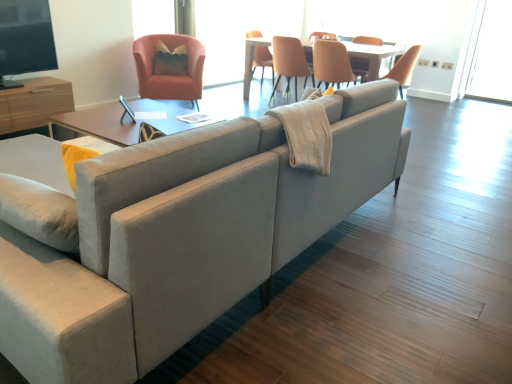
What do you see at coordinates (240, 31) in the screenshot? I see `transparent glass window screen at upper center, the second window screen in the right-to-left sequence` at bounding box center [240, 31].

Image resolution: width=512 pixels, height=384 pixels. Identify the location of light gray fabric couch at center. (184, 237).

Describe the element at coordinates (332, 63) in the screenshot. I see `leather-like beige chair at center, marked as the third chair in a left-to-right arrangement` at that location.

This screenshot has width=512, height=384. What are the coordinates of `light wood table at center` in the screenshot? It's located at (372, 56).

At what (x,y) coordinates should I click in order to perform the action: click on transparent glass window screen at upper center, which is the 1th window screen from left to right. Please return your answer as a coordinate pair (x, y). The image size is (512, 384). Looking at the image, I should click on (153, 17).

Image resolution: width=512 pixels, height=384 pixels. Describe the element at coordinates (170, 60) in the screenshot. I see `velvet yellow pillow at upper center` at that location.

Measure the distance between velvet yellow pillow at upper center and camera.

velvet yellow pillow at upper center is 4.62 meters away from camera.

Locate an element on the screen. transparent glass window screen at upper center, which is the 2th window screen from left to right is located at coordinates (240, 31).

Considering the relative sizes of leather-like beige chair at center, marked as the third chair in a left-to-right arrangement, and transparent glass window screen at upper center, the third window screen in the right-to-left sequence, in the image provided, is leather-like beige chair at center, marked as the third chair in a left-to-right arrangement, bigger than transparent glass window screen at upper center, the third window screen in the right-to-left sequence,?

Correct, leather-like beige chair at center, marked as the third chair in a left-to-right arrangement, is larger in size than transparent glass window screen at upper center, the third window screen in the right-to-left sequence.

How different are the orientations of leather-like beige chair at center, marked as the third chair in a left-to-right arrangement, and transparent glass window screen at upper center, which is the 1th window screen from left to right, in degrees?

leather-like beige chair at center, marked as the third chair in a left-to-right arrangement, and transparent glass window screen at upper center, which is the 1th window screen from left to right, are facing 93.7 degrees away from each other.

From a real-world perspective, is leather-like beige chair at center, the 1th chair viewed from the right, physically below transparent glass window screen at upper center, the third window screen in the right-to-left sequence?

Yes, from a real-world perspective, leather-like beige chair at center, the 1th chair viewed from the right, is under transparent glass window screen at upper center, the third window screen in the right-to-left sequence.

In the scene shown: Is velvet yellow pillow at upper center taller than light gray fabric couch at center?

Correct, velvet yellow pillow at upper center is much taller as light gray fabric couch at center.

Is velvet yellow pillow at upper center far away from light gray fabric couch at center?

Yes, velvet yellow pillow at upper center and light gray fabric couch at center are quite far apart.

Considering the positions of point (182, 47) and point (215, 162), is point (182, 47) closer or farther from the camera than point (215, 162)?

Point (182, 47) appears to be farther away from the viewer than point (215, 162).

Where is `pillow above the light gray fabric couch at center (from a real-world perspective)`? The image size is (512, 384). pillow above the light gray fabric couch at center (from a real-world perspective) is located at coordinates (170, 60).

Who is shorter, transparent glass window screen at upper center, which is the 1th window screen from left to right, or matte orange chair at upper center, which ranks as the second chair in left-to-right order?

transparent glass window screen at upper center, which is the 1th window screen from left to right, is shorter.

Looking at their sizes, would you say transparent glass window screen at upper center, the third window screen in the right-to-left sequence, is wider or thinner than matte orange chair at upper center, which ranks as the second chair in left-to-right order?

In the image, transparent glass window screen at upper center, the third window screen in the right-to-left sequence, appears to be more narrow than matte orange chair at upper center, which ranks as the second chair in left-to-right order.

From the image's perspective, is transparent glass window screen at upper center, which is the 1th window screen from left to right, above matte orange chair at upper center, which ranks as the second chair in left-to-right order?

Indeed, from the image's perspective, transparent glass window screen at upper center, which is the 1th window screen from left to right, is shown above matte orange chair at upper center, which ranks as the second chair in left-to-right order.

From the picture: Is transparent glass window screen at upper center, which is the 1th window screen from left to right, next to matte orange chair at upper center, which ranks as the second chair in left-to-right order?

There is a gap between transparent glass window screen at upper center, which is the 1th window screen from left to right, and matte orange chair at upper center, which ranks as the second chair in left-to-right order.

From the image's perspective, does wooden entertainment center at left, which is counted as the second entertainment center, starting from the top, appear lower than matte black tv at upper left, which ranks as the 1th entertainment center in top-to-bottom order?

Yes, from the image's perspective, wooden entertainment center at left, which is counted as the second entertainment center, starting from the top, is beneath matte black tv at upper left, which ranks as the 1th entertainment center in top-to-bottom order.

Could you measure the distance between wooden entertainment center at left, which is counted as the second entertainment center, starting from the top, and matte black tv at upper left, arranged as the 2th entertainment center when ordered from the bottom?

wooden entertainment center at left, which is counted as the second entertainment center, starting from the top, is 4.55 inches away from matte black tv at upper left, arranged as the 2th entertainment center when ordered from the bottom.

From a real-world perspective, which is physically below, wooden entertainment center at left, which is counted as the second entertainment center, starting from the top, or matte black tv at upper left, which ranks as the 1th entertainment center in top-to-bottom order?

wooden entertainment center at left, which is counted as the second entertainment center, starting from the top.

Which is correct: wooden entertainment center at left, which is counted as the second entertainment center, starting from the top, is inside matte black tv at upper left, arranged as the 2th entertainment center when ordered from the bottom, or outside of it?

The correct answer is: outside.

From the image's perspective, which one is positioned lower, wooden entertainment center at left, which is counted as the second entertainment center, starting from the top, or matte orange armchair at upper left, which is counted as the third chair, starting from the right?

From the image's view, wooden entertainment center at left, which is counted as the second entertainment center, starting from the top, is below.

Considering the positions of objects wooden entertainment center at left, which is counted as the second entertainment center, starting from the top, and matte orange armchair at upper left, which is counted as the third chair, starting from the right, in the image provided, who is more to the left, wooden entertainment center at left, which is counted as the second entertainment center, starting from the top, or matte orange armchair at upper left, which is counted as the third chair, starting from the right,?

wooden entertainment center at left, which is counted as the second entertainment center, starting from the top.

Is point (72, 106) positioned before point (138, 50)?

Yes.

Would you say matte orange armchair at upper left, which is counted as the third chair, starting from the right, is part of wooden entertainment center at left, which is counted as the second entertainment center, starting from the top,'s contents?

No, matte orange armchair at upper left, which is counted as the third chair, starting from the right, is not a part of wooden entertainment center at left, which is counted as the second entertainment center, starting from the top.

Visually, is wooden entertainment center at left, which is counted as the second entertainment center, starting from the top, positioned to the left or to the right of velvet yellow pillow at upper center?

In the image, wooden entertainment center at left, which is counted as the second entertainment center, starting from the top, appears on the left side of velvet yellow pillow at upper center.

At what (x,y) coordinates should I click in order to perform the action: click on the 2nd entertainment center counting from the left of the velvet yellow pillow at upper center. Please return your answer as a coordinate pair (x, y). The image size is (512, 384). Looking at the image, I should click on (34, 103).

Considering the sizes of objects wooden entertainment center at left, marked as the 1th entertainment center in a bottom-to-top arrangement, and velvet yellow pillow at upper center in the image provided, who is wider, wooden entertainment center at left, marked as the 1th entertainment center in a bottom-to-top arrangement, or velvet yellow pillow at upper center?

wooden entertainment center at left, marked as the 1th entertainment center in a bottom-to-top arrangement, is wider.

Is point (273, 44) farther from viewer compared to point (321, 44)?

Yes, point (273, 44) is behind point (321, 44).

Is matte orange chair at upper center, which ranks as the second chair in left-to-right order, touching leather-like beige chair at center, marked as the third chair in a left-to-right arrangement?

No, matte orange chair at upper center, which ranks as the second chair in left-to-right order, is not making contact with leather-like beige chair at center, marked as the third chair in a left-to-right arrangement.

From a real-world perspective, who is located higher, matte orange chair at upper center, which is the 2th chair from right to left, or leather-like beige chair at center, marked as the third chair in a left-to-right arrangement?

leather-like beige chair at center, marked as the third chair in a left-to-right arrangement, from a real-world perspective.

At what (x,y) coordinates should I click in order to perform the action: click on window screen that is the 2nd one when counting upward from the leather-like beige chair at center, the 1th chair viewed from the right (from the image's perspective). Please return your answer as a coordinate pair (x, y). The height and width of the screenshot is (384, 512). Looking at the image, I should click on (153, 17).

This screenshot has width=512, height=384. I want to click on studio couch in front of the velvet yellow pillow at upper center, so click(184, 237).

Looking at the image, which one is located closer to transparent glass window screen at upper center, the third window screen in the right-to-left sequence, transparent glass window at upper right, the first window screen positioned from the right, or matte orange armchair at upper left, marked as the first chair in a left-to-right arrangement?

matte orange armchair at upper left, marked as the first chair in a left-to-right arrangement.

From the image, which object appears to be farther from velvet yellow pillow at upper center, matte orange armchair at upper left, which is counted as the third chair, starting from the right, or transparent glass window screen at upper center, the second window screen in the right-to-left sequence?

Based on the image, transparent glass window screen at upper center, the second window screen in the right-to-left sequence, appears to be further to velvet yellow pillow at upper center.

Looking at the image, which one is located closer to leather-like beige chair at center, marked as the third chair in a left-to-right arrangement, wooden entertainment center at left, marked as the 1th entertainment center in a bottom-to-top arrangement, or transparent glass window screen at upper center, which is the 2th window screen from left to right?

transparent glass window screen at upper center, which is the 2th window screen from left to right, is closer to leather-like beige chair at center, marked as the third chair in a left-to-right arrangement.

Which object lies nearer to the anchor point light wood table at center, transparent glass window screen at upper center, the third window screen in the right-to-left sequence, or wooden entertainment center at left, which is counted as the second entertainment center, starting from the top?

transparent glass window screen at upper center, the third window screen in the right-to-left sequence, lies closer to light wood table at center than the other object.

When comparing their distances from light gray fabric couch at center, does wooden entertainment center at left, marked as the 1th entertainment center in a bottom-to-top arrangement, or transparent glass window screen at upper center, the third window screen in the right-to-left sequence, seem closer?

wooden entertainment center at left, marked as the 1th entertainment center in a bottom-to-top arrangement, lies closer to light gray fabric couch at center than the other object.

From the image, which object appears to be nearer to matte orange armchair at upper left, which is counted as the third chair, starting from the right, transparent glass window screen at upper center, the third window screen in the right-to-left sequence, or light gray fabric couch at center?

The object closer to matte orange armchair at upper left, which is counted as the third chair, starting from the right, is transparent glass window screen at upper center, the third window screen in the right-to-left sequence.

Estimate the real-world distances between objects in this image. Which object is closer to matte black tv at upper left, which ranks as the 1th entertainment center in top-to-bottom order, matte orange armchair at upper left, marked as the first chair in a left-to-right arrangement, or light gray fabric couch at center?

The object closer to matte black tv at upper left, which ranks as the 1th entertainment center in top-to-bottom order, is matte orange armchair at upper left, marked as the first chair in a left-to-right arrangement.

Looking at the image, which one is located closer to light wood table at center, velvet yellow pillow at upper center or matte orange armchair at upper left, marked as the first chair in a left-to-right arrangement?

matte orange armchair at upper left, marked as the first chair in a left-to-right arrangement, is closer to light wood table at center.

Locate an element on the screen. window screen between velvet yellow pillow at upper center and transparent glass window at upper right, which is counted as the 3th window screen, starting from the left is located at coordinates (240, 31).

You are a GUI agent. You are given a task and a screenshot of the screen. Output one action in this format:
    pyautogui.click(x=<x>, y=<y>)
    Task: Click on the pillow between matte black tv at upper left, arranged as the 2th entertainment center when ordered from the bottom, and transparent glass window at upper right, which is counted as the 3th window screen, starting from the left
    The height and width of the screenshot is (384, 512).
    Given the screenshot: What is the action you would take?
    [x=170, y=60]

The image size is (512, 384). Find the location of `entertainment center between matte black tv at upper left, which ranks as the 1th entertainment center in top-to-bottom order, and velvet yellow pillow at upper center from front to back`. entertainment center between matte black tv at upper left, which ranks as the 1th entertainment center in top-to-bottom order, and velvet yellow pillow at upper center from front to back is located at coordinates (34, 103).

Where is `pillow between wooden entertainment center at left, which is counted as the second entertainment center, starting from the top, and transparent glass window screen at upper center, which is the 2th window screen from left to right, in the front-back direction`? The width and height of the screenshot is (512, 384). pillow between wooden entertainment center at left, which is counted as the second entertainment center, starting from the top, and transparent glass window screen at upper center, which is the 2th window screen from left to right, in the front-back direction is located at coordinates (170, 60).